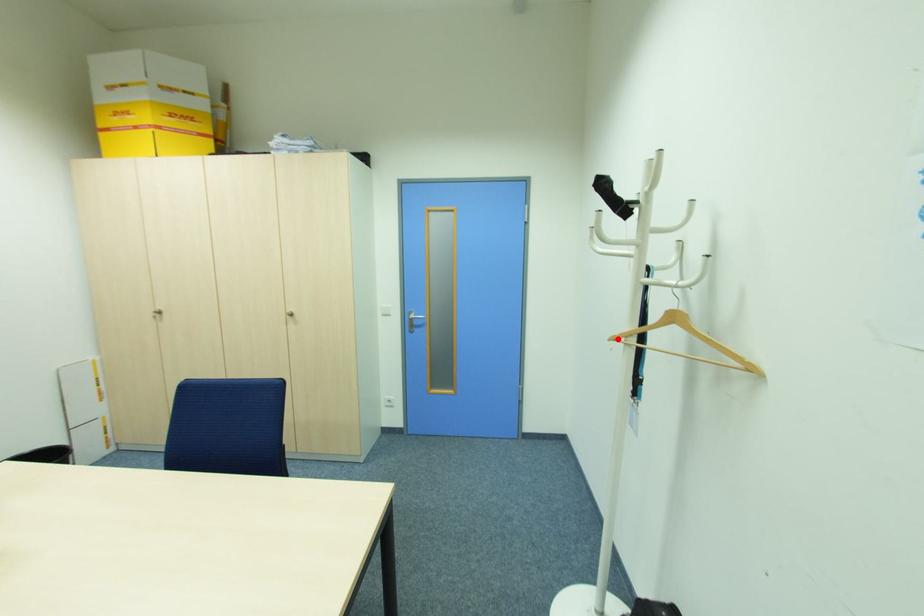
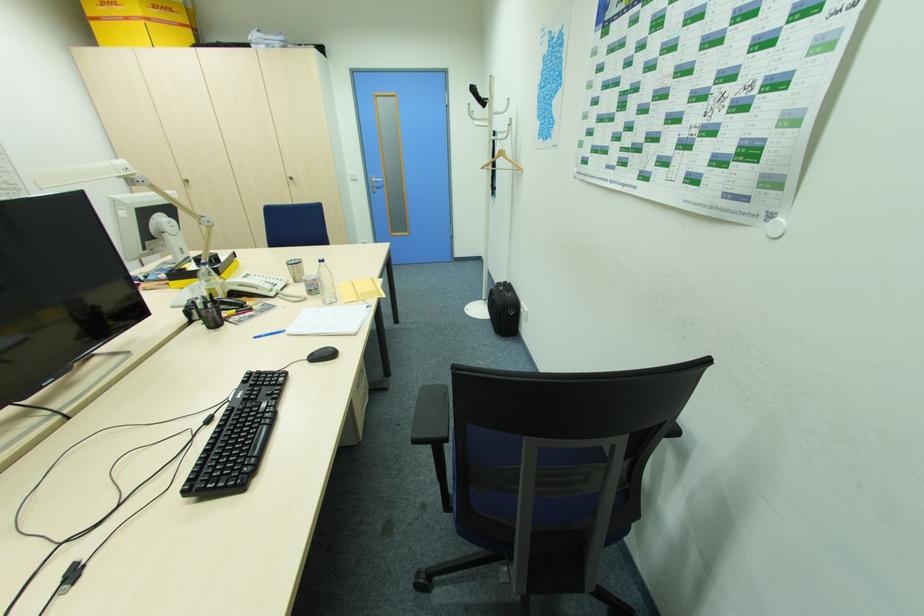
Question: I am providing you with two images of the same scene from different viewpoints. A red point is shown in image1. For the corresponding object point in image2, is it positioned nearer or farther from the camera?

Choices:
 (A) Nearer
 (B) Farther

Answer: (A)